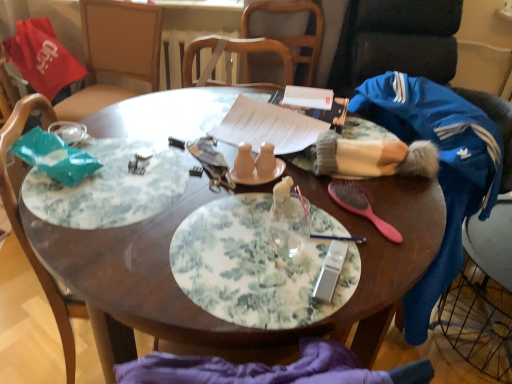
The image size is (512, 384). In order to click on matte ceramic salt and pepper shakers at center, which is the first tableware in left-to-right order in this screenshot , I will do `click(244, 162)`.

Locate an element on the screen. blue fleece jacket at right is located at coordinates (439, 169).

Describe the element at coordinates (292, 36) in the screenshot. Image resolution: width=512 pixels, height=384 pixels. I see `wooden chair at upper center, marked as the 1th chair in a right-to-left arrangement` at that location.

You are a GUI agent. You are given a task and a screenshot of the screen. Output one action in this format:
    pyautogui.click(x=<x>, y=<y>)
    Task: Click on the green floral placemat at left
    The image size is (512, 384).
    Given the screenshot: What is the action you would take?
    pyautogui.click(x=110, y=186)

What do you see at coordinates (396, 41) in the screenshot?
I see `blue fabric armchair at upper right` at bounding box center [396, 41].

Image resolution: width=512 pixels, height=384 pixels. I want to click on pink plastic hairbrush at center-right, the first tableware positioned from the right, so click(x=360, y=205).

Which of these two, blue fleece jacket at right or matte ceramic salt and pepper shakers at center, arranged as the third tableware when viewed from the right, is thinner?

matte ceramic salt and pepper shakers at center, arranged as the third tableware when viewed from the right, is thinner.

Is there a large distance between blue fleece jacket at right and matte ceramic salt and pepper shakers at center, marked as the third tableware in a left-to-right arrangement?

No, blue fleece jacket at right is not far away from matte ceramic salt and pepper shakers at center, marked as the third tableware in a left-to-right arrangement.

Is blue fleece jacket at right oriented away from matte ceramic salt and pepper shakers at center, arranged as the third tableware when viewed from the right?

No, matte ceramic salt and pepper shakers at center, arranged as the third tableware when viewed from the right, is not at the back of blue fleece jacket at right.

Which object is positioned more to the left, blue fleece jacket at right or matte ceramic salt and pepper shakers at center, arranged as the third tableware when viewed from the right?

From the viewer's perspective, matte ceramic salt and pepper shakers at center, arranged as the third tableware when viewed from the right, appears more on the left side.

Identify the location of the 2nd chair positioned above the wooden table at center (from the image's perspective). (292, 36).

Can you confirm if wooden table at center is shorter than wooden chair at upper center, marked as the 1th chair in a right-to-left arrangement?

In fact, wooden table at center may be taller than wooden chair at upper center, marked as the 1th chair in a right-to-left arrangement.

Is wooden table at center thinner than wooden chair at upper center, which ranks as the first chair in top-to-bottom order?

No, wooden table at center is not thinner than wooden chair at upper center, which ranks as the first chair in top-to-bottom order.

Which is more to the left, wooden table at center or wooden chair at upper center, marked as the 1th chair in a right-to-left arrangement?

wooden table at center.

Considering the positions of points (329, 235) and (254, 183), is point (329, 235) farther from camera compared to point (254, 183)?

No, (329, 235) is closer to viewer.

Looking at the image, does metallic silver pen at center, which appears as the fourth tableware when viewed from the left, seem bigger or smaller compared to matte ceramic salt and pepper shakers at center, acting as the 4th tableware starting from the right?

metallic silver pen at center, which appears as the fourth tableware when viewed from the left, is smaller than matte ceramic salt and pepper shakers at center, acting as the 4th tableware starting from the right.

How different are the orientations of metallic silver pen at center, which is counted as the second tableware, starting from the right, and matte ceramic salt and pepper shakers at center, acting as the 4th tableware starting from the right, in degrees?

The facing directions of metallic silver pen at center, which is counted as the second tableware, starting from the right, and matte ceramic salt and pepper shakers at center, acting as the 4th tableware starting from the right, are 100 degrees apart.

Where is `tableware that is the 3rd one when counting backward from the metallic silver pen at center, which appears as the fourth tableware when viewed from the left`? tableware that is the 3rd one when counting backward from the metallic silver pen at center, which appears as the fourth tableware when viewed from the left is located at coordinates (260, 176).

Is green floral placemat at left located within matte ceramic salt and pepper shakers at center, which is the first tableware in left-to-right order?

No, green floral placemat at left is not a part of matte ceramic salt and pepper shakers at center, which is the first tableware in left-to-right order.

Does point (250, 159) come in front of point (94, 198)?

That is False.

Considering the relative positions of matte ceramic salt and pepper shakers at center, which is the first tableware in left-to-right order, and green floral placemat at left in the image provided, is matte ceramic salt and pepper shakers at center, which is the first tableware in left-to-right order, to the left of green floral placemat at left from the viewer's perspective?

No, matte ceramic salt and pepper shakers at center, which is the first tableware in left-to-right order, is not to the left of green floral placemat at left.

The image size is (512, 384). What are the coordinates of `platter to the left of matte ceramic salt and pepper shakers at center, acting as the 5th tableware starting from the right` in the screenshot? It's located at (110, 186).

From the picture: Between wooden chair at upper center, arranged as the first chair when viewed from the back, and blue fabric swivel chair at right, which one has larger width?

With larger width is blue fabric swivel chair at right.

Is wooden chair at upper center, which appears as the 2th chair when viewed from the front, next to blue fabric swivel chair at right and touching it?

wooden chair at upper center, which appears as the 2th chair when viewed from the front, is not next to blue fabric swivel chair at right, and they're not touching.

The height and width of the screenshot is (384, 512). I want to click on swivel chair that is under the wooden chair at upper center, marked as the 1th chair in a right-to-left arrangement (from a real-world perspective), so click(483, 295).

Looking at this image, from the image's perspective, between wooden chair at upper center, marked as the 1th chair in a right-to-left arrangement, and blue fabric swivel chair at right, who is located below?

From the image's view, blue fabric swivel chair at right is below.

Is green floral placemat at left to the right of matte ceramic salt and pepper shakers at center, which is the first tableware in left-to-right order, from the viewer's perspective?

No.

Is there a large distance between green floral placemat at left and matte ceramic salt and pepper shakers at center, acting as the 5th tableware starting from the right?

green floral placemat at left is actually quite close to matte ceramic salt and pepper shakers at center, acting as the 5th tableware starting from the right.

From the image's perspective, is green floral placemat at left above or below matte ceramic salt and pepper shakers at center, acting as the 5th tableware starting from the right?

green floral placemat at left is below matte ceramic salt and pepper shakers at center, acting as the 5th tableware starting from the right.

Could you tell me if green floral placemat at left is turned towards matte ceramic salt and pepper shakers at center, acting as the 5th tableware starting from the right?

Yes, green floral placemat at left is turned towards matte ceramic salt and pepper shakers at center, acting as the 5th tableware starting from the right.

Can you confirm if wooden chair at left, which is the second chair from back to front, is shorter than blue fabric armchair at upper right?

In fact, wooden chair at left, which is the second chair from back to front, may be taller than blue fabric armchair at upper right.

Does wooden chair at left, marked as the first chair in a bottom-to-top arrangement, turn towards blue fabric armchair at upper right?

No, wooden chair at left, marked as the first chair in a bottom-to-top arrangement, does not turn towards blue fabric armchair at upper right.

Looking at this image, between wooden chair at left, marked as the first chair in a bottom-to-top arrangement, and blue fabric armchair at upper right, which one has smaller size?

wooden chair at left, marked as the first chair in a bottom-to-top arrangement, is smaller.

From a real-world perspective, which tableware is the 4th one above the blue fleece jacket at right? Please provide its 2D coordinates.

[(265, 161)]

The height and width of the screenshot is (384, 512). In order to click on the 2nd chair above the wooden table at center (from the image's perspective) in this screenshot , I will do `click(292, 36)`.

Based on the photo, which object lies nearer to the anchor point wooden chair at upper center, placed as the 2th chair when sorted from left to right, matte ceramic salt and pepper shakers at center, marked as the third tableware in a left-to-right arrangement, or blue fabric swivel chair at right?

matte ceramic salt and pepper shakers at center, marked as the third tableware in a left-to-right arrangement.

From the picture: Which object lies nearer to the anchor point blue fabric armchair at upper right, blue fabric swivel chair at right or matte ceramic salt and pepper shakers at center, acting as the 5th tableware starting from the right?

Based on the image, blue fabric swivel chair at right appears to be nearer to blue fabric armchair at upper right.

Based on their spatial positions, is matte ceramic salt and pepper shakers at center, which is the first tableware in left-to-right order, or floral-patterned plate at center closer to wooden chair at left, which is the 2th chair from top to bottom?

floral-patterned plate at center.

When comparing their distances from blue fabric armchair at upper right, does metallic silver pen at center, which is counted as the second tableware, starting from the right, or matte ceramic salt and pepper shakers at center, placed as the second tableware when sorted from left to right, seem closer?

Among the two, matte ceramic salt and pepper shakers at center, placed as the second tableware when sorted from left to right, is located nearer to blue fabric armchair at upper right.

Based on their spatial positions, is matte ceramic salt and pepper shakers at center, placed as the second tableware when sorted from left to right, or blue fleece jacket at right further from green floral placemat at left?

blue fleece jacket at right is further to green floral placemat at left.

From the image, which object appears to be farther from blue fleece jacket at right, green floral placemat at left or pink plastic hairbrush at center-right, the first tableware positioned from the right?

green floral placemat at left.

Which object lies further to the anchor point matte ceramic salt and pepper shakers at center, acting as the 5th tableware starting from the right, wooden chair at left, marked as the first chair in a bottom-to-top arrangement, or green floral placemat at left?

wooden chair at left, marked as the first chair in a bottom-to-top arrangement, is further to matte ceramic salt and pepper shakers at center, acting as the 5th tableware starting from the right.

Looking at the image, which one is located further to blue fabric armchair at upper right, wooden table at center or matte ceramic salt and pepper shakers at center, arranged as the third tableware when viewed from the right?

matte ceramic salt and pepper shakers at center, arranged as the third tableware when viewed from the right, is further to blue fabric armchair at upper right.

The width and height of the screenshot is (512, 384). Find the location of `plate between wooden table at center and matte ceramic salt and pepper shakers at center, which is the first tableware in left-to-right order, along the z-axis`. plate between wooden table at center and matte ceramic salt and pepper shakers at center, which is the first tableware in left-to-right order, along the z-axis is located at coordinates (252, 267).

The height and width of the screenshot is (384, 512). I want to click on tableware between matte ceramic salt and pepper shakers at center, arranged as the third tableware when viewed from the right, and wooden chair at upper center, placed as the 2th chair when sorted from left to right, in the front-back direction, so click(x=260, y=176).

Where is `clothing between wooden chair at left, which appears as the first chair when viewed from the front, and wooden chair at upper center, placed as the 2th chair when sorted from left to right, in the front-back direction`? The height and width of the screenshot is (384, 512). clothing between wooden chair at left, which appears as the first chair when viewed from the front, and wooden chair at upper center, placed as the 2th chair when sorted from left to right, in the front-back direction is located at coordinates (439, 169).

The height and width of the screenshot is (384, 512). Find the location of `desk between wooden chair at left, which appears as the first chair when viewed from the front, and pink plastic hairbrush at center-right, the first tableware positioned from the right, in the horizontal direction`. desk between wooden chair at left, which appears as the first chair when viewed from the front, and pink plastic hairbrush at center-right, the first tableware positioned from the right, in the horizontal direction is located at coordinates (110, 288).